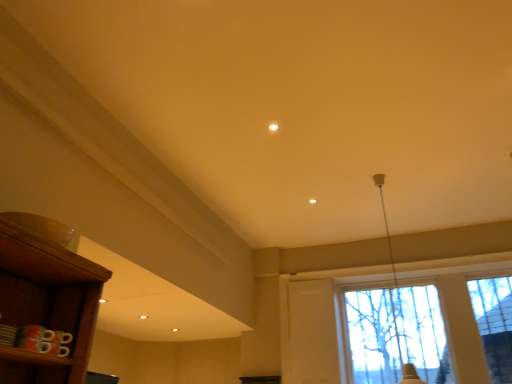
Question: Should I look upward or downward to see transparent glass window at center?

Choices:
 (A) down
 (B) up

Answer: (A)

Question: From the image's perspective, is white glossy lampshade at upper right below transparent glass window at center?

Choices:
 (A) no
 (B) yes

Answer: (A)

Question: Is white glossy lampshade at upper right positioned in front of transparent glass window at center?

Choices:
 (A) yes
 (B) no

Answer: (A)

Question: Is transparent glass window at center a part of white glossy lampshade at upper right?

Choices:
 (A) no
 (B) yes

Answer: (A)

Question: Is white glossy lampshade at upper right completely or partially outside of transparent glass window at center?

Choices:
 (A) no
 (B) yes

Answer: (B)

Question: Is white glossy lampshade at upper right shorter than transparent glass window at center?

Choices:
 (A) no
 (B) yes

Answer: (A)

Question: Considering the relative sizes of white glossy lampshade at upper right and transparent glass window at center in the image provided, is white glossy lampshade at upper right wider than transparent glass window at center?

Choices:
 (A) yes
 (B) no

Answer: (A)

Question: Considering the relative positions of transparent glass window at center and white glossy lampshade at upper right in the image provided, is transparent glass window at center behind white glossy lampshade at upper right?

Choices:
 (A) yes
 (B) no

Answer: (A)

Question: From the image's perspective, is transparent glass window at center on top of white glossy lampshade at upper right?

Choices:
 (A) no
 (B) yes

Answer: (A)

Question: Considering the relative sizes of transparent glass window at center and white glossy lampshade at upper right in the image provided, is transparent glass window at center shorter than white glossy lampshade at upper right?

Choices:
 (A) no
 (B) yes

Answer: (B)

Question: Is transparent glass window at center wider than white glossy lampshade at upper right?

Choices:
 (A) yes
 (B) no

Answer: (B)

Question: Can you confirm if transparent glass window at center is smaller than white glossy lampshade at upper right?

Choices:
 (A) yes
 (B) no

Answer: (A)

Question: Can we say transparent glass window at center lies outside white glossy lampshade at upper right?

Choices:
 (A) no
 (B) yes

Answer: (B)

Question: In terms of height, does transparent glass window at center look taller or shorter compared to white glossy lampshade at upper right?

Choices:
 (A) short
 (B) tall

Answer: (A)